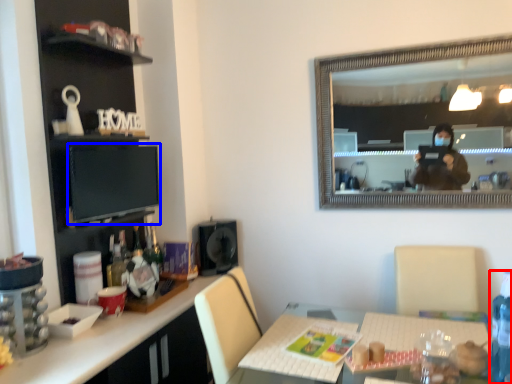
Question: Which of the following is the farthest to the observer, bottle (highlighted by a red box) or computer monitor (highlighted by a blue box)?

Choices:
 (A) bottle
 (B) computer monitor

Answer: (B)